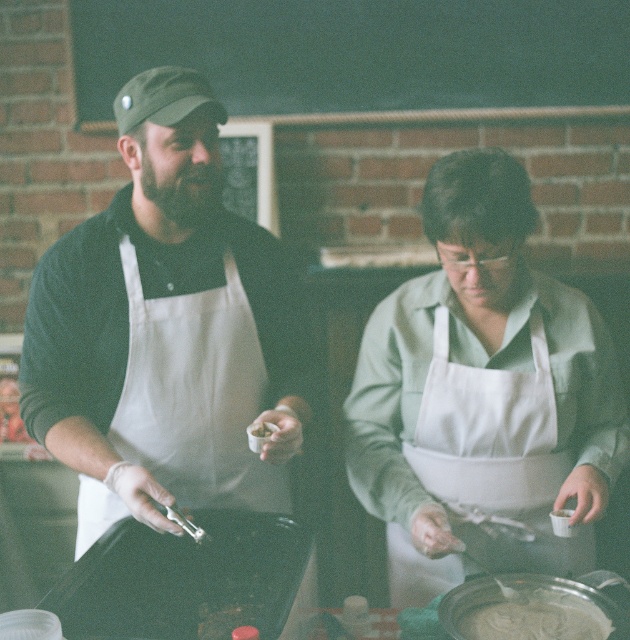
Question: Does matte white apron at left appear on the right side of white matte apron at center?

Choices:
 (A) yes
 (B) no

Answer: (B)

Question: Can you confirm if green chalkboard at upper center is smaller than white fabric apron at center?

Choices:
 (A) yes
 (B) no

Answer: (A)

Question: Which of the following is the farthest from the observer?

Choices:
 (A) white creamy batter at lower center
 (B) matte white apron at left
 (C) green chalkboard at upper center
 (D) white fabric apron at center

Answer: (C)

Question: Which object is the closest to the white creamy batter at lower center?

Choices:
 (A) white matte apron at center
 (B) white fabric apron at center
 (C) green chalkboard at upper center
 (D) matte white apron at left

Answer: (B)

Question: Is white matte apron at center wider than white creamy batter at lower center?

Choices:
 (A) yes
 (B) no

Answer: (A)

Question: Which is nearer to the white fabric apron at center?

Choices:
 (A) white creamy batter at lower center
 (B) matte white apron at left

Answer: (A)